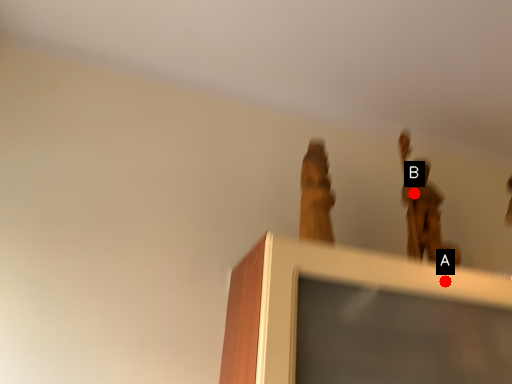
Question: Two points are circled on the image, labeled by A and B beside each circle. Which point appears farthest from the camera in this image?

Choices:
 (A) A is further
 (B) B is further

Answer: (B)